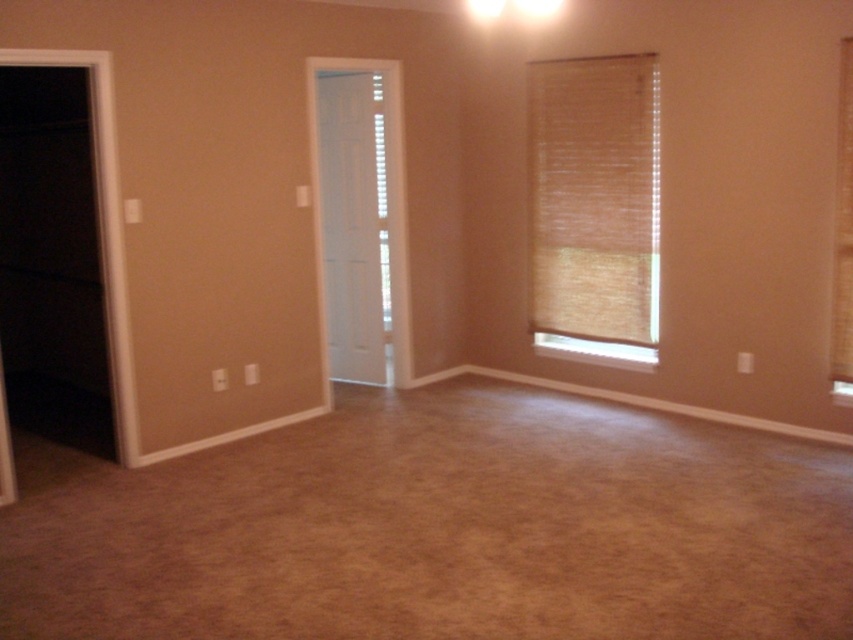
Does point (570, 124) come behind point (840, 122)?

Yes, point (570, 124) is farther from viewer.

Who is positioned more to the right, bamboo blind at right or brown textured curtain at right?

From the viewer's perspective, brown textured curtain at right appears more on the right side.

Who is more forward, (592, 336) or (833, 307)?

Point (833, 307)

At what (x,y) coordinates should I click in order to perform the action: click on bamboo blind at right. Please return your answer as a coordinate pair (x, y). This screenshot has height=640, width=853. Looking at the image, I should click on (595, 198).